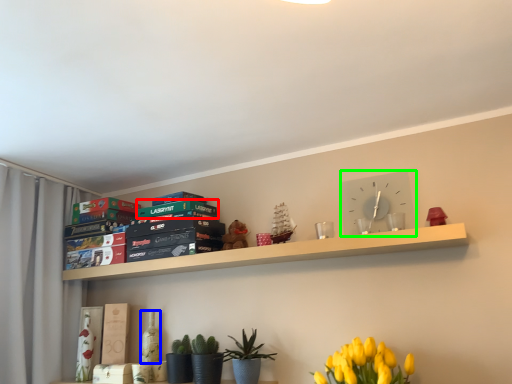
Question: Which object is positioned closest to paperback book (highlighted by a red box)? Select from bottle (highlighted by a blue box) and clock (highlighted by a green box).

Choices:
 (A) bottle
 (B) clock

Answer: (A)